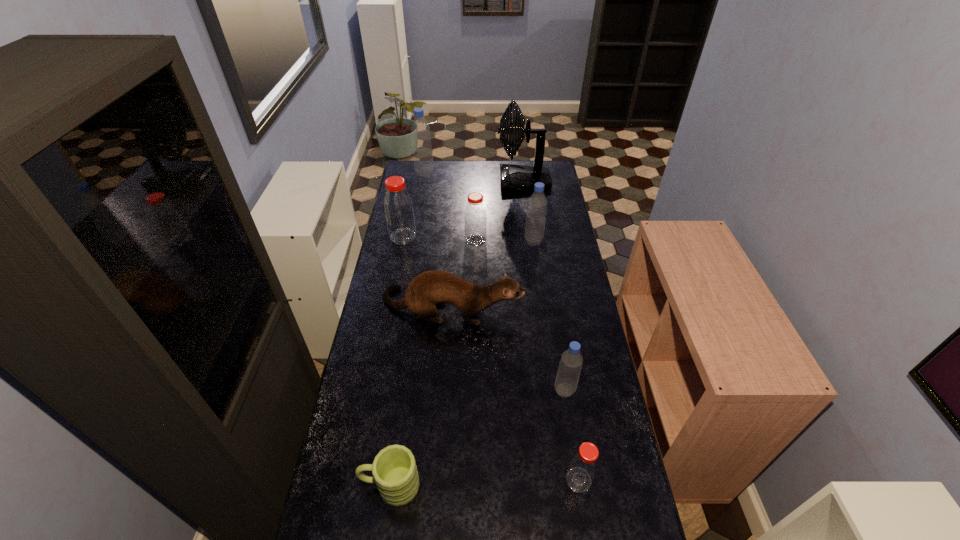
This screenshot has width=960, height=540. I want to click on free space between the fan and the smallest blue bottle, so click(x=544, y=286).

Identify the location of free spot between the shortest object and the nearest bottle. (485, 483).

Locate which object ranks second in proximity to the ferret. Please provide its 2D coordinates. Your answer should be formatted as a tuple, i.e. [(x, y)], where the tuple contains the x and y coordinates of a point satisfying the conditions above.

[(537, 204)]

Choose which object is the fourth nearest neighbor to the green mug. Please provide its 2D coordinates. Your answer should be formatted as a tuple, i.e. [(x, y)], where the tuple contains the x and y coordinates of a point satisfying the conditions above.

[(475, 218)]

Identify which bottle is the second closest to the fan. Please provide its 2D coordinates. Your answer should be formatted as a tuple, i.e. [(x, y)], where the tuple contains the x and y coordinates of a point satisfying the conditions above.

[(537, 204)]

Find the location of a particular element. bottle that can be found as the sixth closest to the brown ferret is located at coordinates (420, 130).

You are a GUI agent. You are given a task and a screenshot of the screen. Output one action in this format:
    pyautogui.click(x=<x>, y=<y>)
    Task: Click on the closest blue bottle to the tallest bottle
    The height and width of the screenshot is (540, 960).
    Given the screenshot: What is the action you would take?
    pyautogui.click(x=537, y=204)

Identify which blue bottle is the third closest to the shortest object. Please provide its 2D coordinates. Your answer should be formatted as a tuple, i.e. [(x, y)], where the tuple contains the x and y coordinates of a point satisfying the conditions above.

[(420, 130)]

Locate which red bottle ranks third in proximity to the farthest bottle. Please provide its 2D coordinates. Your answer should be formatted as a tuple, i.e. [(x, y)], where the tuple contains the x and y coordinates of a point satisfying the conditions above.

[(583, 466)]

Identify which red bottle is located as the second nearest to the leftmost red bottle. Please provide its 2D coordinates. Your answer should be formatted as a tuple, i.e. [(x, y)], where the tuple contains the x and y coordinates of a point satisfying the conditions above.

[(583, 466)]